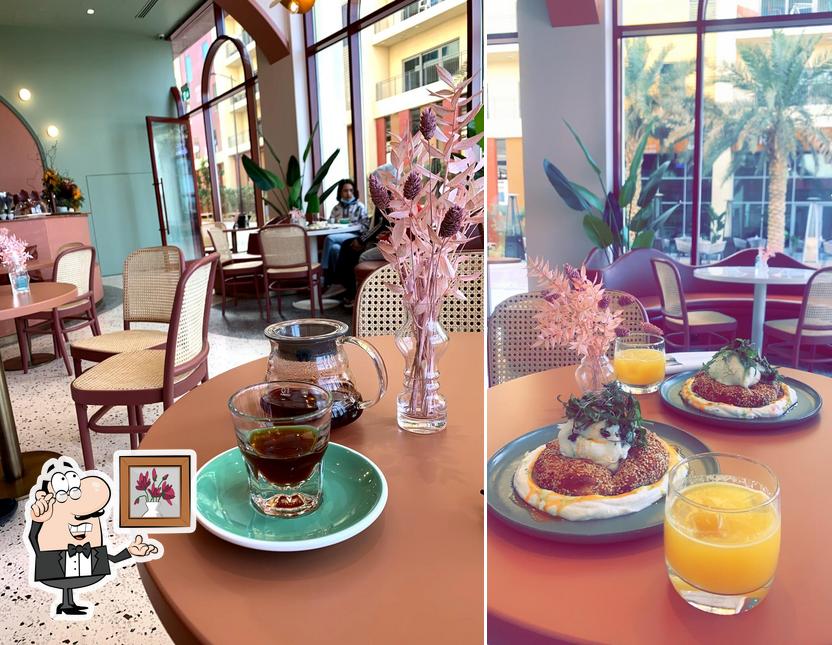
Image resolution: width=832 pixels, height=645 pixels. I want to click on vase, so click(409, 408), click(585, 373), click(22, 283), click(299, 217), click(35, 210), click(62, 208).